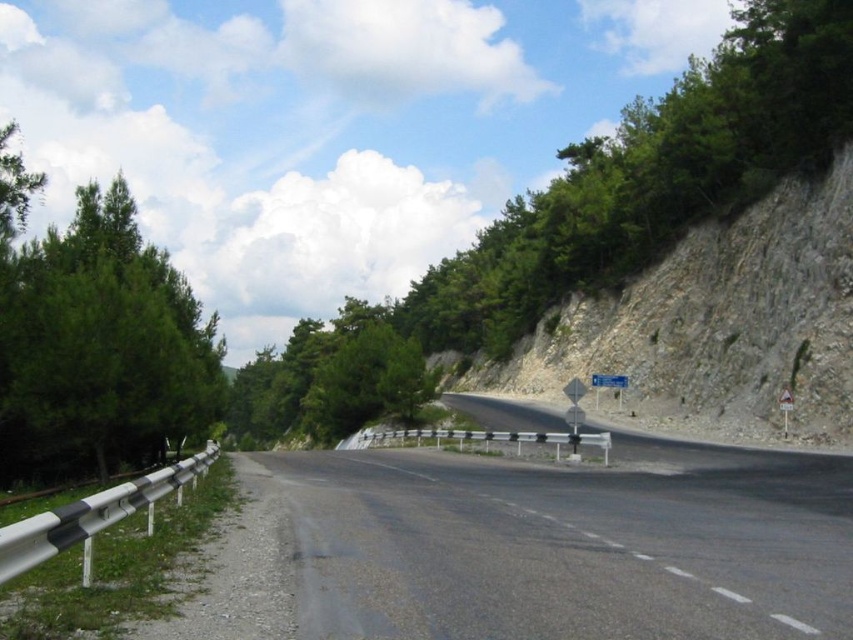
You are a hiker standing at the point marked by the coordinates point (596, 209) on the scenic road. You want to reach the dense greenery on the left side of the road. Which direction should you walk to get there?

The point (596, 209) corresponds to the green leafy tree at upper center. To reach the dense greenery on the left side of the road, you should walk towards the left side of the road from the green leafy tree at upper center.